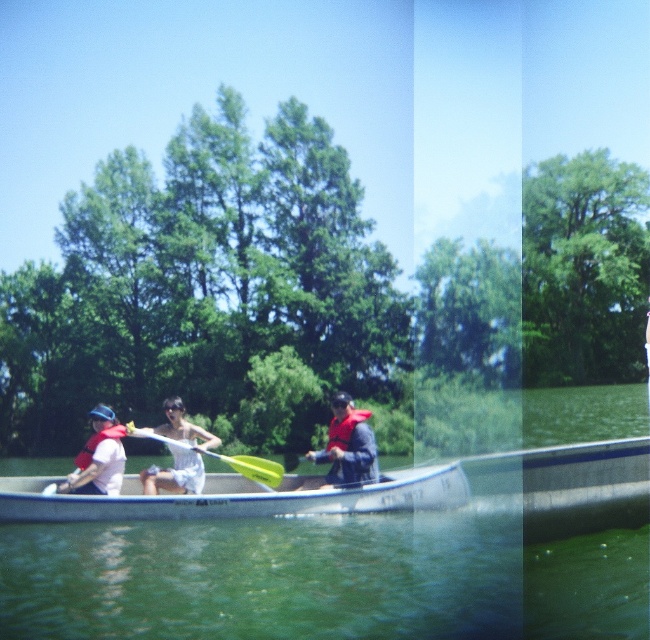
Which is above, yellow plastic paddle at center or red matte life jacket at center?

Positioned higher is red matte life jacket at center.

Can you confirm if yellow plastic paddle at center is smaller than red matte life jacket at center?

Actually, yellow plastic paddle at center might be larger than red matte life jacket at center.

Image resolution: width=650 pixels, height=640 pixels. I want to click on yellow plastic paddle at center, so click(222, 458).

The width and height of the screenshot is (650, 640). I want to click on red life vest at center, so click(348, 444).

Can you confirm if red life vest at center is positioned below matte red life vest at left?

Yes.

Identify the location of red life vest at center. The width and height of the screenshot is (650, 640). (348, 444).

Does green liquid water at center have a lesser width compared to matte red life vest at left?

No.

Is green liquid water at center further to the viewer compared to matte red life vest at left?

No, it is not.

Is point (36, 460) positioned before point (105, 477)?

That is False.

In order to click on green liquid water at center in this screenshot , I will do `click(320, 579)`.